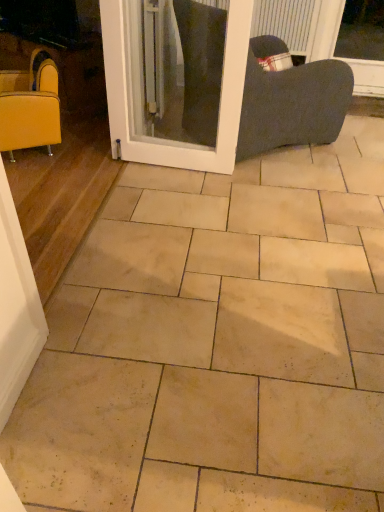
Question: Does white glossy screen door at center have a larger size compared to matte yellow armchair at left?

Choices:
 (A) no
 (B) yes

Answer: (A)

Question: Is white glossy screen door at center not inside matte yellow armchair at left?

Choices:
 (A) yes
 (B) no

Answer: (A)

Question: Does white glossy screen door at center have a greater width compared to matte yellow armchair at left?

Choices:
 (A) no
 (B) yes

Answer: (A)

Question: Is white glossy screen door at center not near matte yellow armchair at left?

Choices:
 (A) no
 (B) yes

Answer: (A)

Question: Is white glossy screen door at center turned away from matte yellow armchair at left?

Choices:
 (A) no
 (B) yes

Answer: (A)

Question: Considering the relative sizes of white glossy screen door at center and matte yellow armchair at left in the image provided, is white glossy screen door at center thinner than matte yellow armchair at left?

Choices:
 (A) no
 (B) yes

Answer: (B)

Question: From the image's perspective, does matte yellow armchair at left appear lower than white glossy screen door at center?

Choices:
 (A) yes
 (B) no

Answer: (A)

Question: Considering the relative sizes of matte yellow armchair at left and white glossy screen door at center in the image provided, is matte yellow armchair at left shorter than white glossy screen door at center?

Choices:
 (A) no
 (B) yes

Answer: (B)

Question: Considering the relative positions of matte yellow armchair at left and white glossy screen door at center in the image provided, is matte yellow armchair at left behind white glossy screen door at center?

Choices:
 (A) yes
 (B) no

Answer: (A)

Question: Can you confirm if matte yellow armchair at left is wider than white glossy screen door at center?

Choices:
 (A) yes
 (B) no

Answer: (A)

Question: Is matte yellow armchair at left turned away from white glossy screen door at center?

Choices:
 (A) no
 (B) yes

Answer: (A)

Question: Is matte yellow armchair at left thinner than white glossy screen door at center?

Choices:
 (A) no
 (B) yes

Answer: (A)

Question: Is point (114, 146) closer or farther from the camera than point (21, 83)?

Choices:
 (A) farther
 (B) closer

Answer: (A)